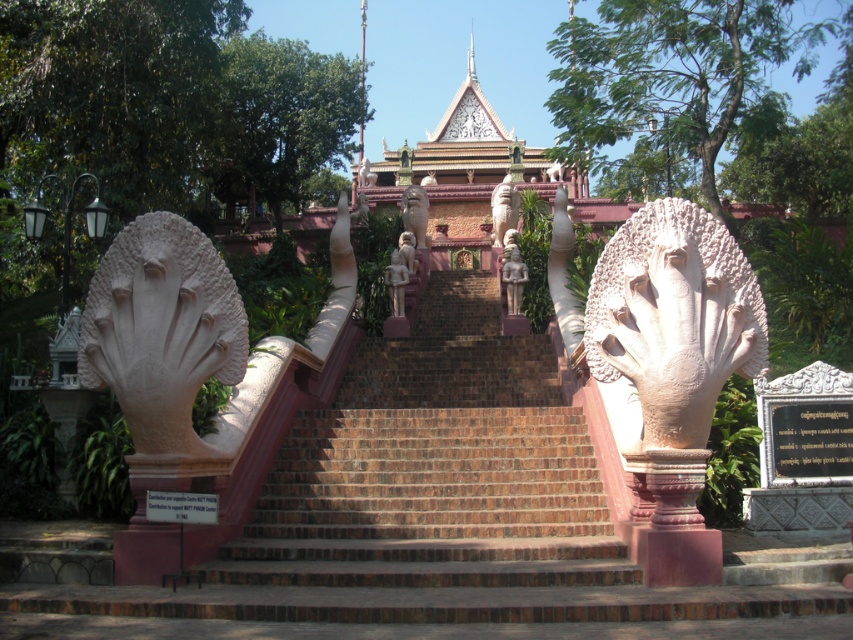
Is point (177, 268) closer to camera compared to point (415, 262)?

That is True.

Can you confirm if white stone hand at left is wider than matte stone statue at center?

In fact, white stone hand at left might be narrower than matte stone statue at center.

What do you see at coordinates (161, 333) in the screenshot?
I see `white stone hand at left` at bounding box center [161, 333].

Identify the location of white stone hand at left. The height and width of the screenshot is (640, 853). (161, 333).

Is smooth stone statue at center positioned at the back of stone statue at center?

Yes.

Which is above, smooth stone statue at center or stone statue at center?

smooth stone statue at center is above.

Who is more distant from viewer, [408,214] or [520,257]?

The point [408,214] is more distant.

Image resolution: width=853 pixels, height=640 pixels. Identify the location of smooth stone statue at center. (415, 212).

Who is more distant from viewer, (596, 324) or (412, 248)?

The point (412, 248) is behind.

Which of these two, white stone hand at center or matte stone statue at center, stands shorter?

With less height is white stone hand at center.

In the scene shown: Who is more distant from viewer, [653,276] or [407,257]?

The point [407,257] is behind.

Locate an element on the screen. The height and width of the screenshot is (640, 853). white stone hand at center is located at coordinates click(x=672, y=317).